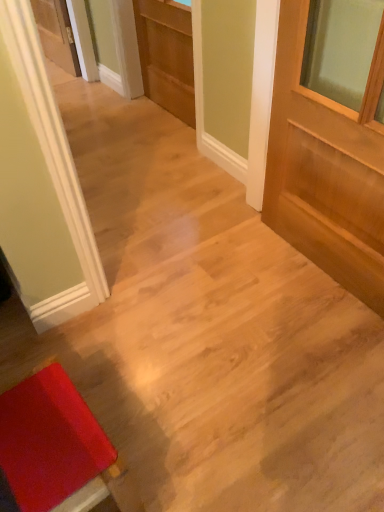
Question: Can you confirm if rubberized red stool at lower left is smaller than light brown wood door at right, which appears as the second door when viewed from the left?

Choices:
 (A) no
 (B) yes

Answer: (B)

Question: Is rubberized red stool at lower left not close to light brown wood door at right, which is counted as the second door, starting from the top?

Choices:
 (A) yes
 (B) no

Answer: (A)

Question: Is rubberized red stool at lower left located outside light brown wood door at right, which ranks as the 2th door in back-to-front order?

Choices:
 (A) yes
 (B) no

Answer: (A)

Question: Considering the relative positions of rubberized red stool at lower left and light brown wood door at right, the 1th door from the bottom, in the image provided, is rubberized red stool at lower left behind light brown wood door at right, the 1th door from the bottom,?

Choices:
 (A) yes
 (B) no

Answer: (B)

Question: Can you confirm if rubberized red stool at lower left is bigger than light brown wood door at right, which ranks as the 2th door in back-to-front order?

Choices:
 (A) yes
 (B) no

Answer: (B)

Question: From a real-world perspective, is rubberized red stool at lower left under light brown wood door at right, the 1th door from the bottom?

Choices:
 (A) no
 (B) yes

Answer: (B)

Question: Does light brown wood door at center, the second door from the bottom, have a greater height compared to rubberized red stool at lower left?

Choices:
 (A) no
 (B) yes

Answer: (B)

Question: Is the depth of light brown wood door at center, acting as the 2th door starting from the front, less than that of rubberized red stool at lower left?

Choices:
 (A) yes
 (B) no

Answer: (B)

Question: Considering the relative positions of light brown wood door at center, arranged as the 1th door when viewed from the back, and rubberized red stool at lower left in the image provided, is light brown wood door at center, arranged as the 1th door when viewed from the back, to the right of rubberized red stool at lower left from the viewer's perspective?

Choices:
 (A) no
 (B) yes

Answer: (B)

Question: From a real-world perspective, is light brown wood door at center, arranged as the 1th door when viewed from the back, physically below rubberized red stool at lower left?

Choices:
 (A) no
 (B) yes

Answer: (A)

Question: Is light brown wood door at center, arranged as the 1th door when viewed from the back, to the left of rubberized red stool at lower left from the viewer's perspective?

Choices:
 (A) yes
 (B) no

Answer: (B)

Question: Does light brown wood door at center, arranged as the 1th door when viewed from the back, have a greater width compared to rubberized red stool at lower left?

Choices:
 (A) no
 (B) yes

Answer: (A)

Question: Is light brown wood door at right, which ranks as the 2th door in back-to-front order, not inside rubberized red stool at lower left?

Choices:
 (A) no
 (B) yes

Answer: (B)